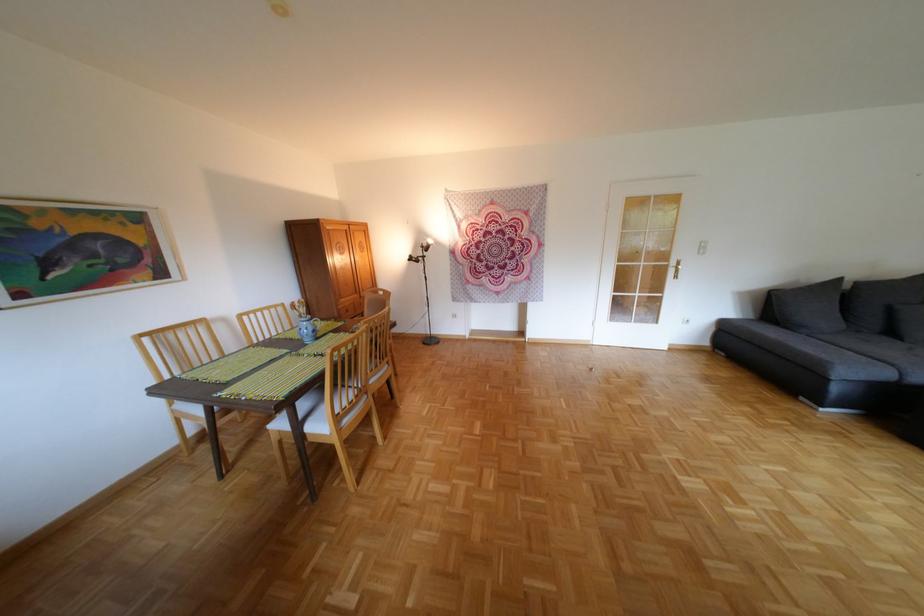
Describe the element at coordinates (420, 252) in the screenshot. I see `a black lamp head` at that location.